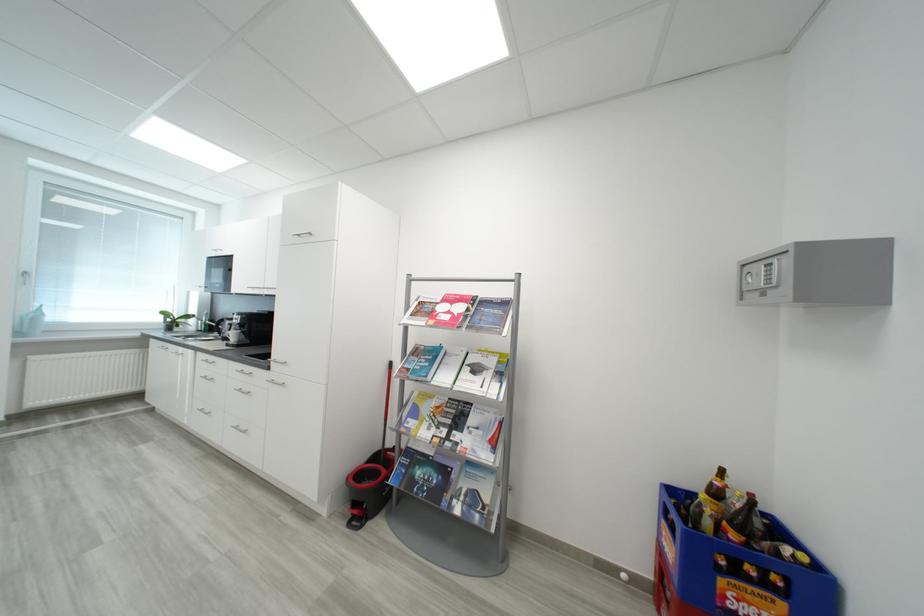
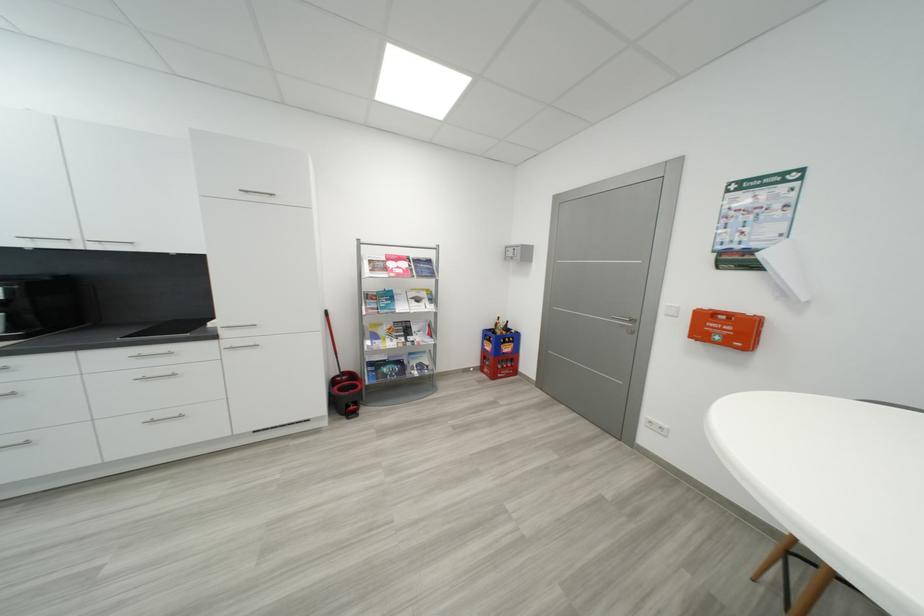
Find the pixel in the second image that matches point 438,315 in the first image.

(393, 270)